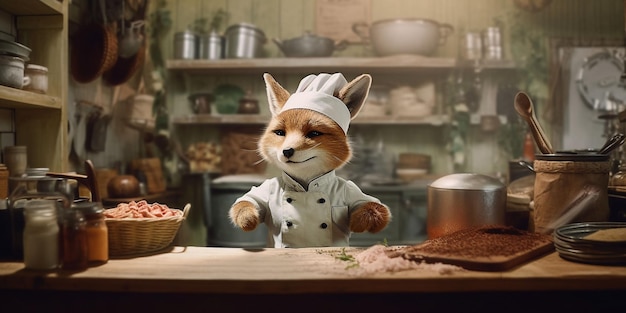
The height and width of the screenshot is (313, 626). What are the coordinates of `kitchen` in the screenshot? It's located at point(309,246).